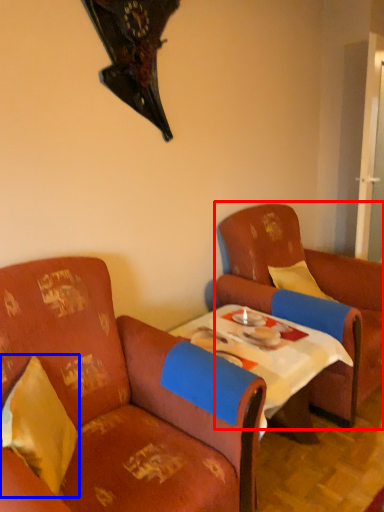
Question: Which object is further to the camera taking this photo, chair (highlighted by a red box) or pillow (highlighted by a blue box)?

Choices:
 (A) chair
 (B) pillow

Answer: (A)